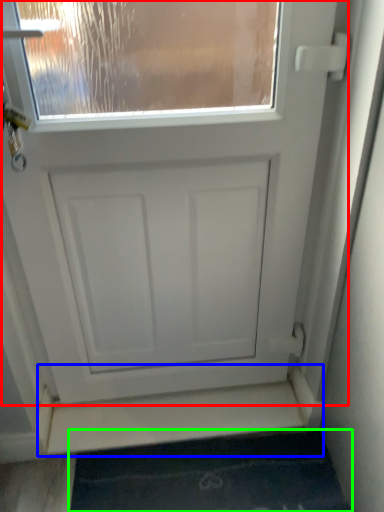
Question: Estimate the real-world distances between objects in this image. Which object is farther from door (highlighted by a red box), stairwell (highlighted by a blue box) or bath mat (highlighted by a green box)?

Choices:
 (A) stairwell
 (B) bath mat

Answer: (B)